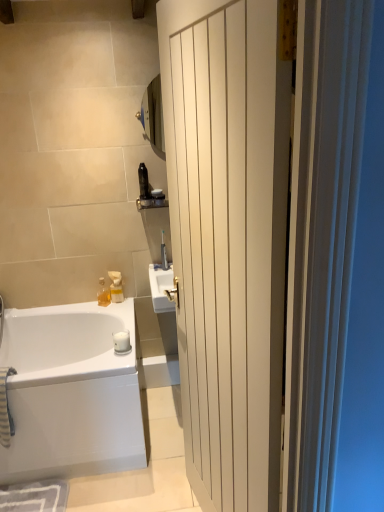
Identify the location of vacant area that is in front of translucent plastic soap dispenser at upper center, the 3th toiletry from the right. This screenshot has width=384, height=512. (119, 308).